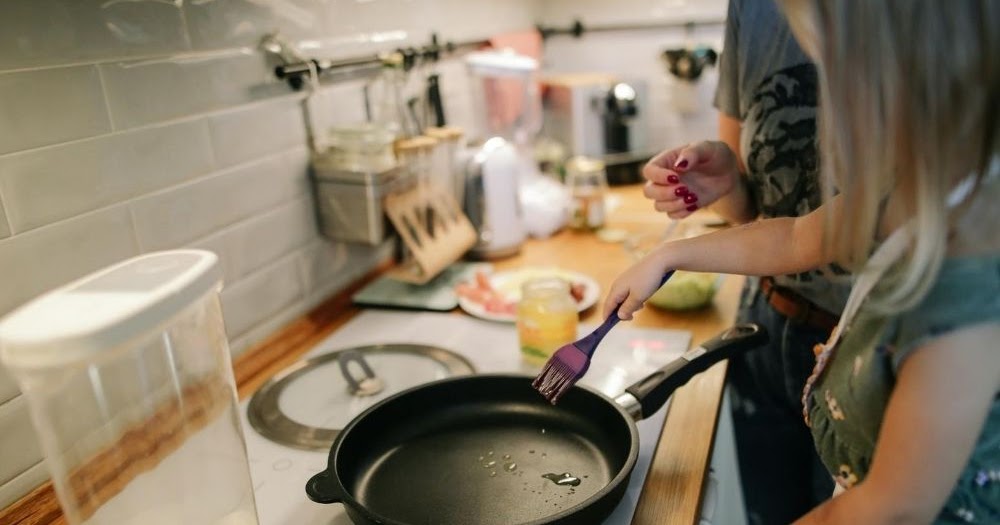
Where is `toaster`? toaster is located at coordinates (625, 107).